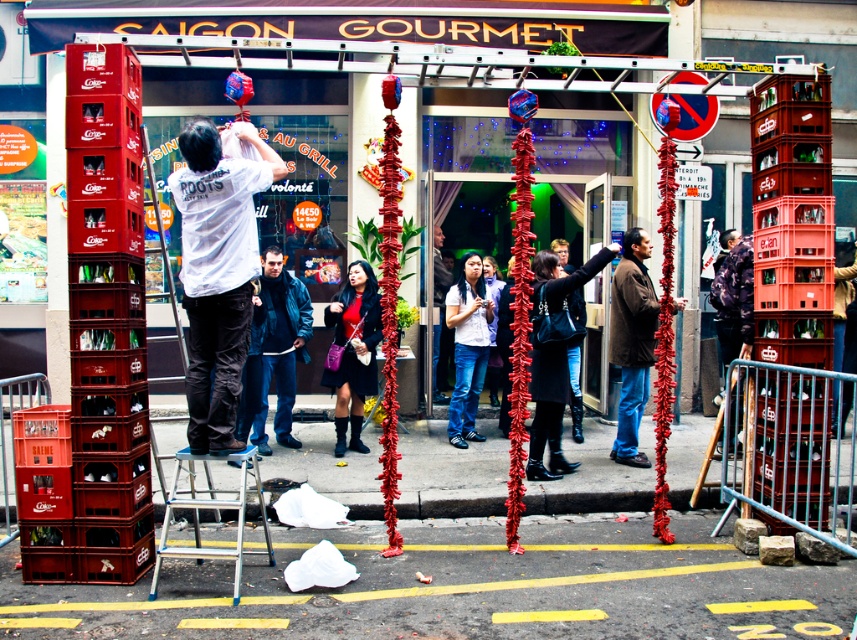
Question: Which of these objects is positioned farthest from the white cotton shirt at center?

Choices:
 (A) blue matte jacket at center
 (B) brown wool coat at center

Answer: (B)

Question: Which point is farther to the camera?

Choices:
 (A) (435, 257)
 (B) (220, 273)
 (C) (283, 310)

Answer: (A)

Question: Is brown wool coat at center positioned in front of blue matte jacket at center?

Choices:
 (A) no
 (B) yes

Answer: (B)

Question: Estimate the real-world distances between objects in this image. Which object is farther from the blue matte jacket at center?

Choices:
 (A) denim jeans at center
 (B) leather jacket at center
 (C) white matte shirt at center

Answer: (C)

Question: Is brown wool coat at center positioned behind denim jeans at center?

Choices:
 (A) no
 (B) yes

Answer: (A)

Question: Observing the image, what is the correct spatial positioning of blue matte jacket at center in reference to leather jacket at center?

Choices:
 (A) below
 (B) above

Answer: (B)